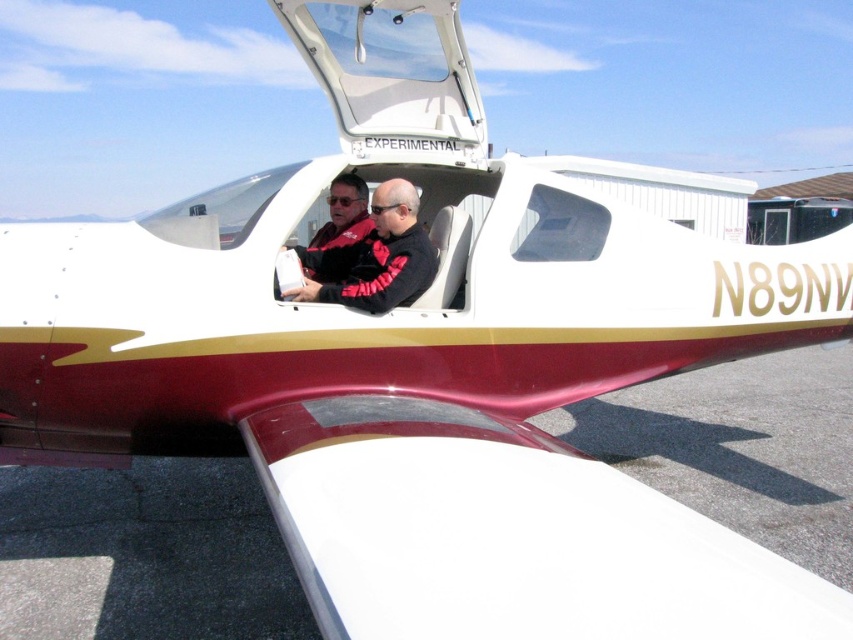
Question: Which object is closer to the camera taking this photo?

Choices:
 (A) red and black jacket at center
 (B) black leather jacket at center

Answer: (B)

Question: Which of the following is the farthest from the observer?

Choices:
 (A) (380, 244)
 (B) (328, 232)

Answer: (B)

Question: Does black leather jacket at center have a smaller size compared to red and black jacket at center?

Choices:
 (A) no
 (B) yes

Answer: (A)

Question: Is black leather jacket at center smaller than red and black jacket at center?

Choices:
 (A) no
 (B) yes

Answer: (A)

Question: Is black leather jacket at center smaller than red and black jacket at center?

Choices:
 (A) no
 (B) yes

Answer: (A)